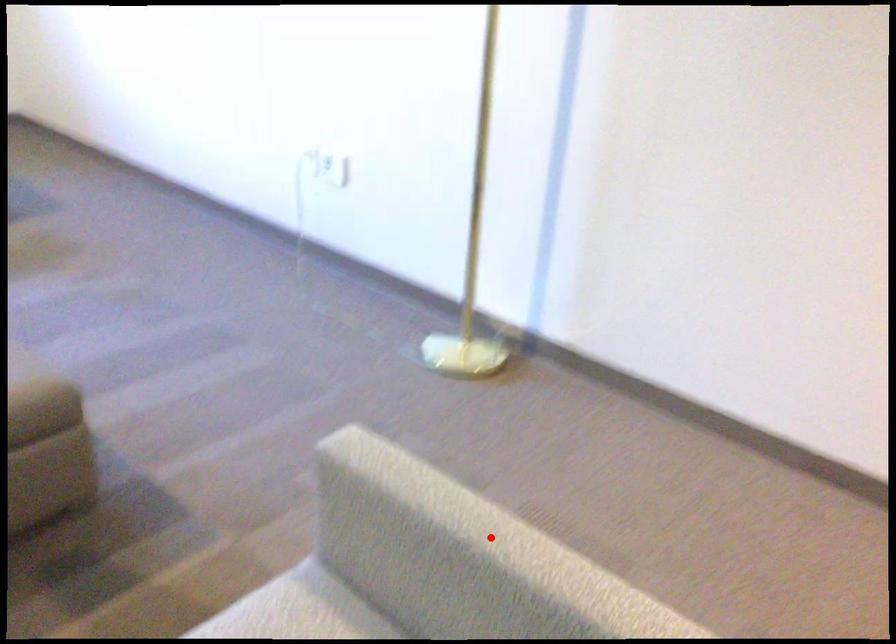
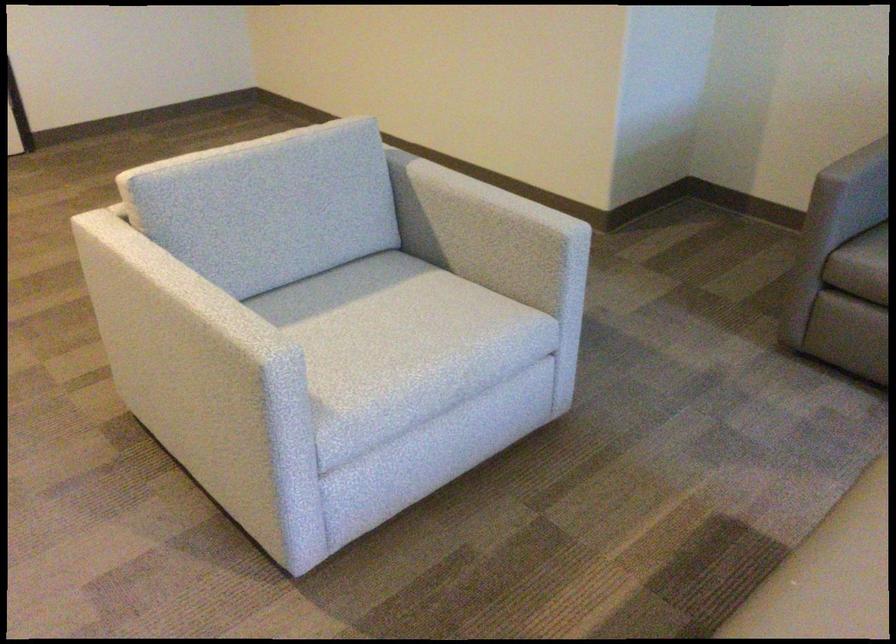
In the second image, find the point that corresponds to the highlighted location in the first image.

(195, 294)